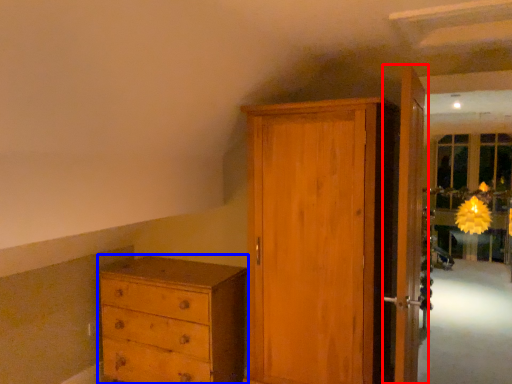
Question: Among these objects, which one is farthest to the camera, door (highlighted by a red box) or chest of drawers (highlighted by a blue box)?

Choices:
 (A) door
 (B) chest of drawers

Answer: (B)